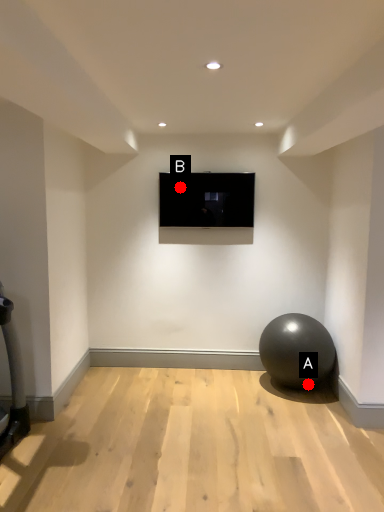
Question: Two points are circled on the image, labeled by A and B beside each circle. Among these points, which one is nearest to the camera?

Choices:
 (A) A is closer
 (B) B is closer

Answer: (A)